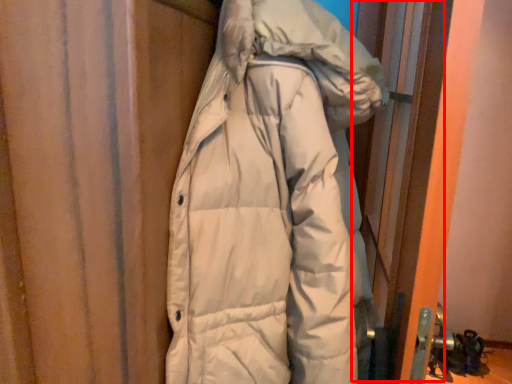
Question: From the image's perspective, what is the correct spatial positioning of screen door (annotated by the red box) in reference to jacket?

Choices:
 (A) above
 (B) below

Answer: (B)